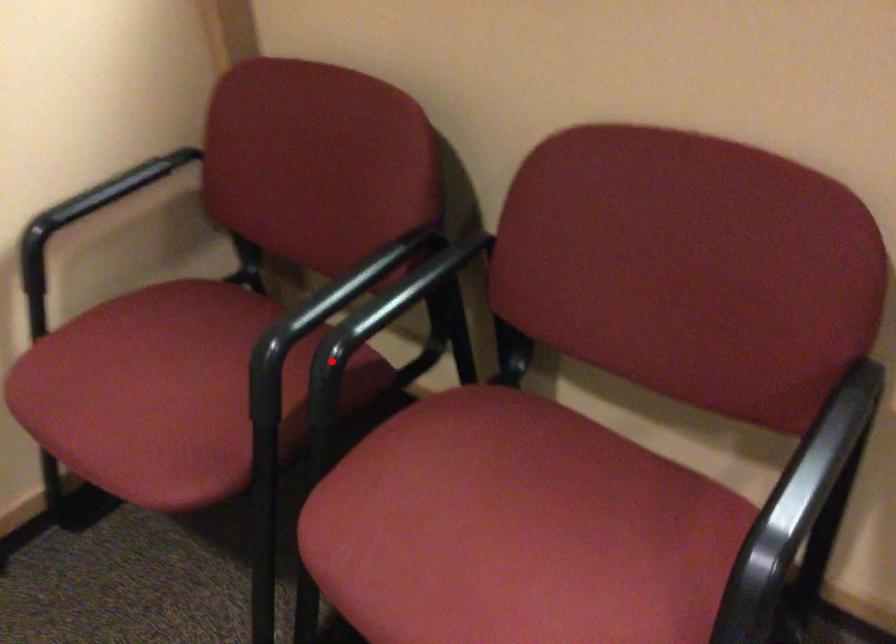
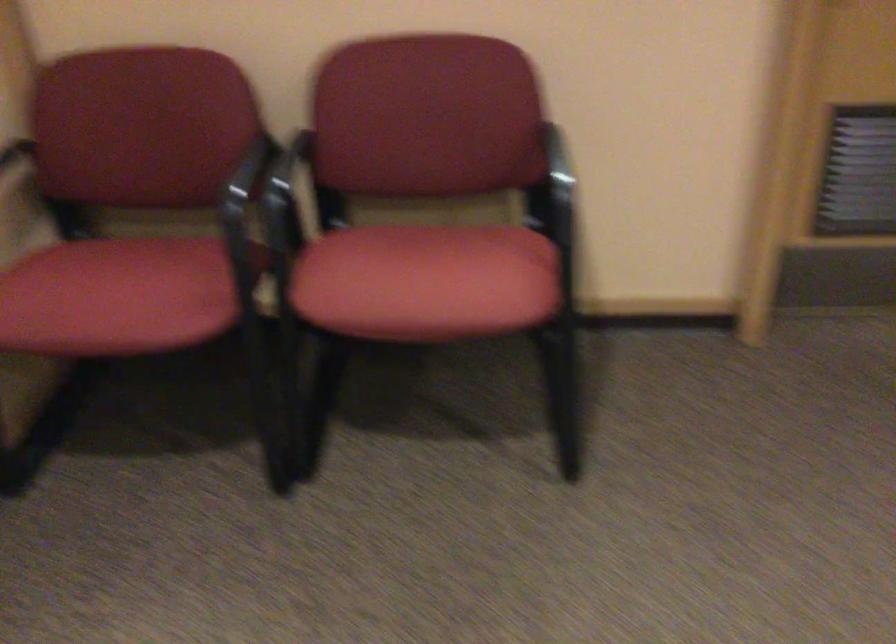
Question: I am providing you with two images of the same scene from different viewpoints. Image1 has a red point marked. In image2, the corresponding 3D location appears at what relative position? Reply with the corresponding letter.

Choices:
 (A) Closer
 (B) Farther

Answer: (B)